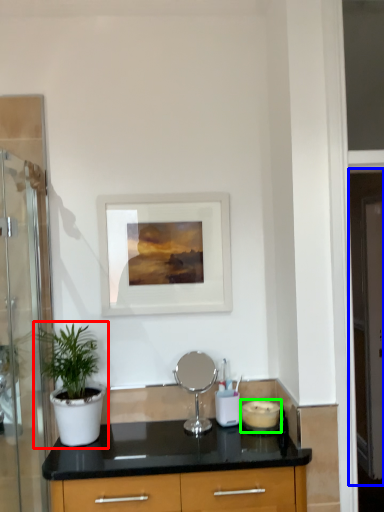
Question: Which object is the closest to the houseplant (highlighted by a red box)? Choose among these: screen door (highlighted by a blue box) or appliance (highlighted by a green box).

Choices:
 (A) screen door
 (B) appliance

Answer: (B)